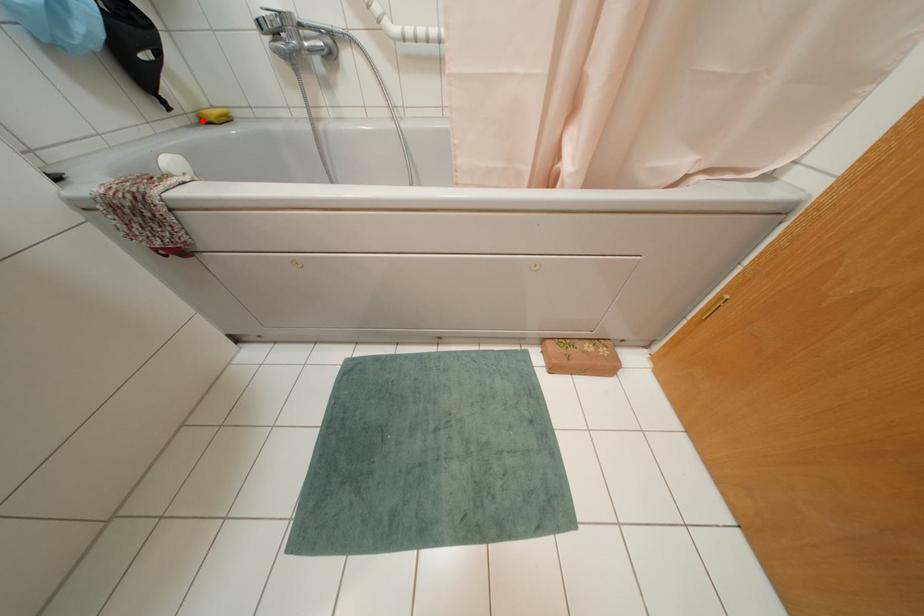
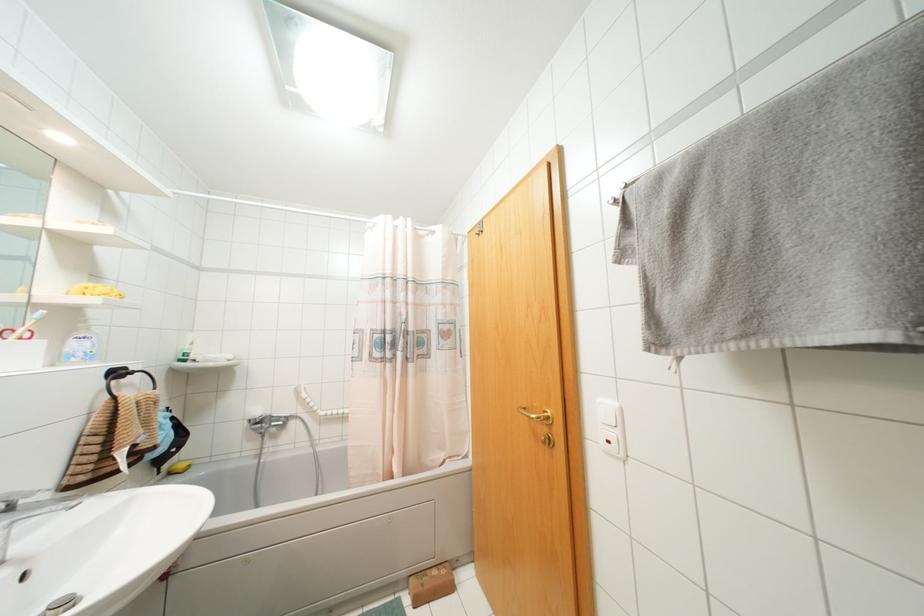
The point at the highlighted location is marked in the first image. Where is the corresponding point in the second image?

(169, 472)